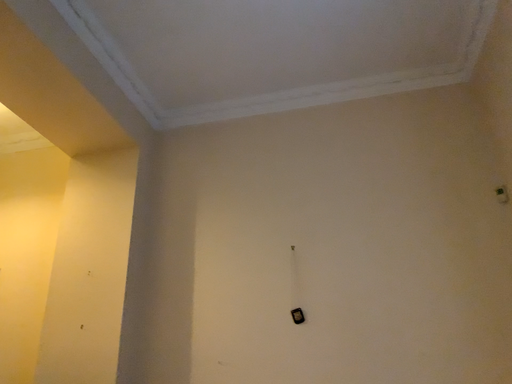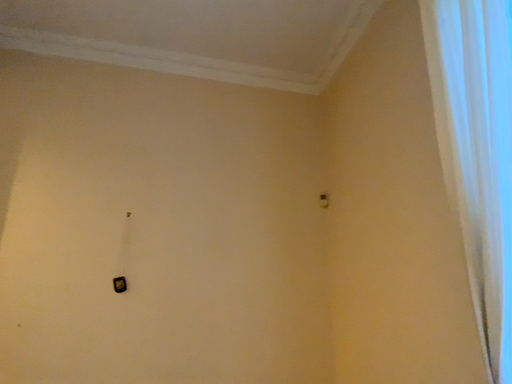
Question: Which way did the camera rotate in the video?

Choices:
 (A) rotated downward
 (B) rotated upward

Answer: (A)